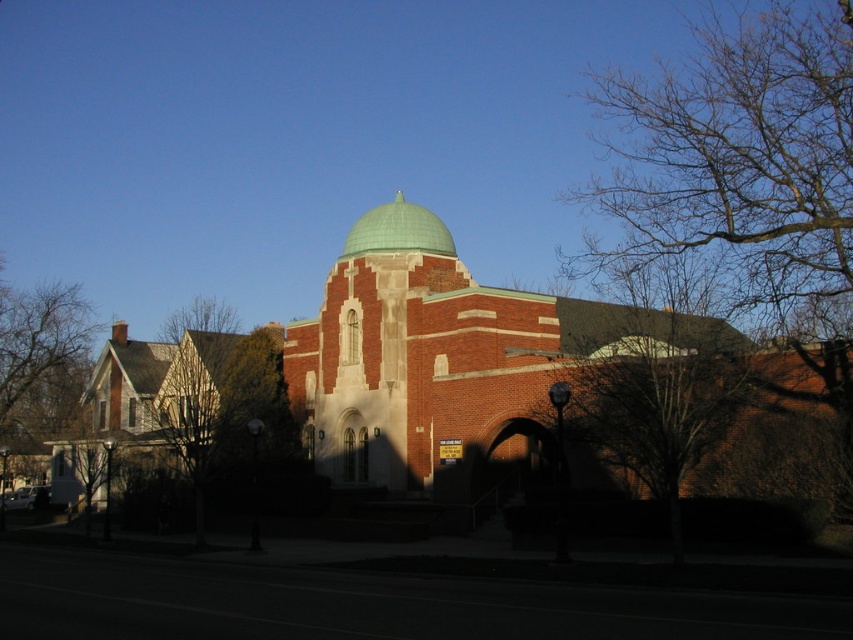
You are an architect analyzing the building. You need to determine if the brick building at center can fit entirely under the green metallic dome at center. Based on their sizes, what is your conclusion?

The brick building at center is wider than the green metallic dome at center, so it cannot fit entirely under the green metallic dome at center.

You are standing in front of the brick building with the teal dome. There are two points marked on the building. One is at coordinates point (850, 256) and the other at point (361, 280). Which point is closer to you?

Point (850, 256) is closer to the viewer than point (361, 280).